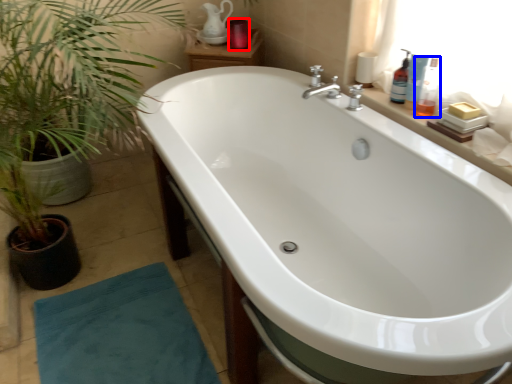
Question: Which object appears farthest to the camera in this image, toiletry (highlighted by a red box) or toiletry (highlighted by a blue box)?

Choices:
 (A) toiletry
 (B) toiletry

Answer: (A)